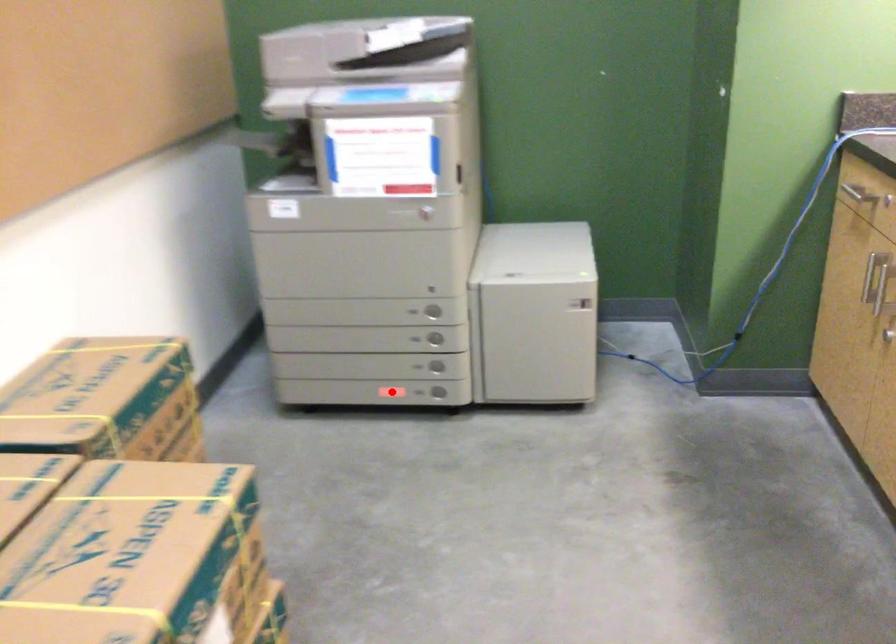
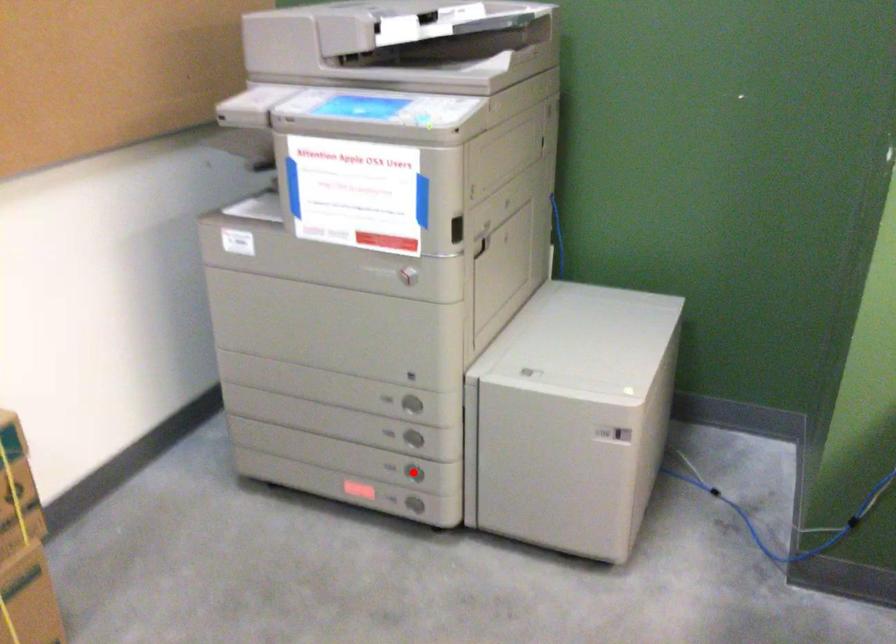
I am providing you with two images of the same scene from different viewpoints. A red point is marked on the first image and another point is marked on the second image. Is the red point in image1 aligned with the point shown in image2?

No